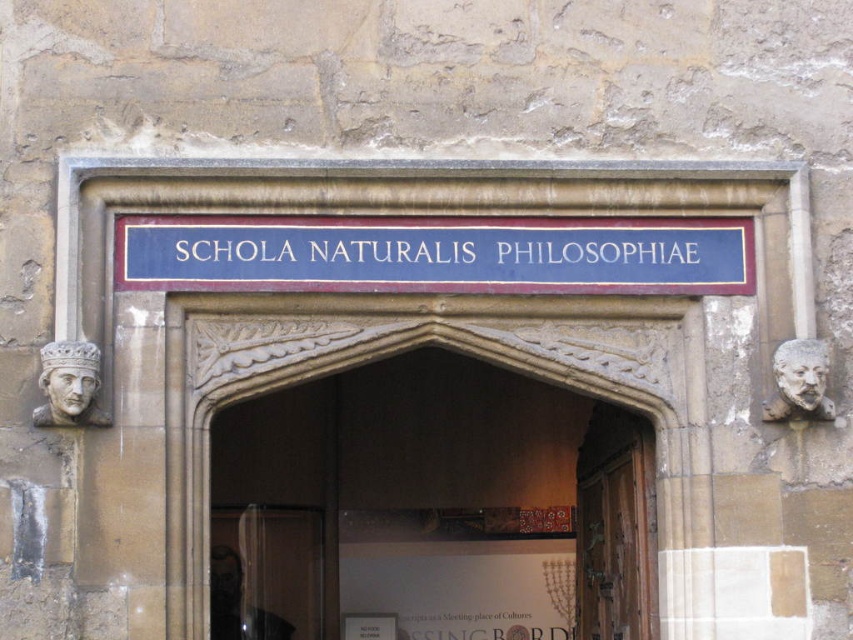
From the picture: Who is taller, blue painted wood sign at center or carved stone archway at center?

With more height is carved stone archway at center.

Between point (560, 262) and point (683, 384), which one is positioned in front?

Point (560, 262) is in front.

Is point (717, 236) more distant than point (675, 582)?

That is True.

Where is `blue painted wood sign at center`? The image size is (853, 640). blue painted wood sign at center is located at coordinates (436, 253).

Can you confirm if blue painted wood sign at center is smaller than wooden at center?

Indeed, blue painted wood sign at center has a smaller size compared to wooden at center.

Which is behind, point (297, 269) or point (624, 500)?

The point (624, 500) is behind.

This screenshot has height=640, width=853. I want to click on blue painted wood sign at center, so click(436, 253).

Does carved stone archway at center appear under wooden at center?

No.

Measure the distance from carved stone archway at center to wooden at center.

The distance of carved stone archway at center from wooden at center is 12.24 meters.

Is point (569, 378) closer to viewer compared to point (621, 470)?

Yes, it is.

What are the coordinates of `carved stone archway at center` in the screenshot? It's located at (363, 362).